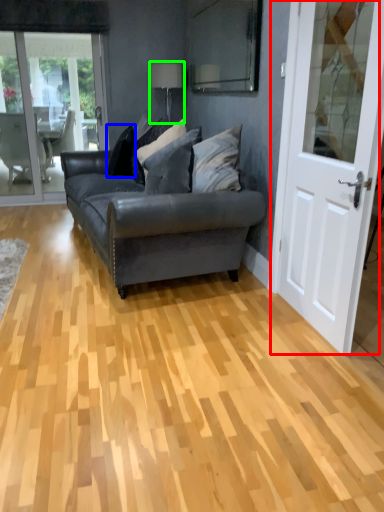
Question: Which object is positioned farthest from door (highlighted by a red box)? Select from pillow (highlighted by a blue box) and lamp (highlighted by a green box).

Choices:
 (A) pillow
 (B) lamp

Answer: (B)